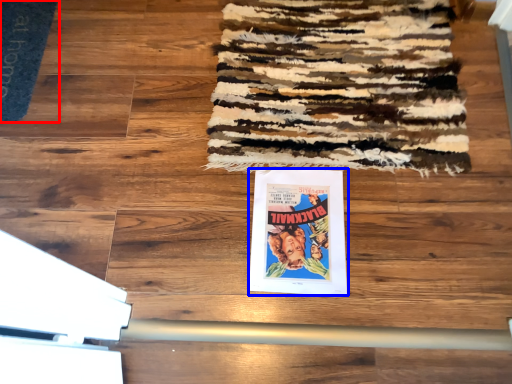
Question: Which point is closer to the camera, doormat (highlighted by a red box) or poster (highlighted by a blue box)?

Choices:
 (A) doormat
 (B) poster

Answer: (B)